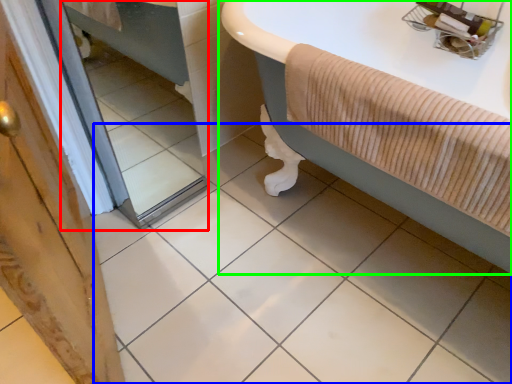
Question: Which object is the closest to the mirror (highlighted by a red box)? Choose among these: ceramic tile (highlighted by a blue box) or bathtub (highlighted by a green box).

Choices:
 (A) ceramic tile
 (B) bathtub

Answer: (A)